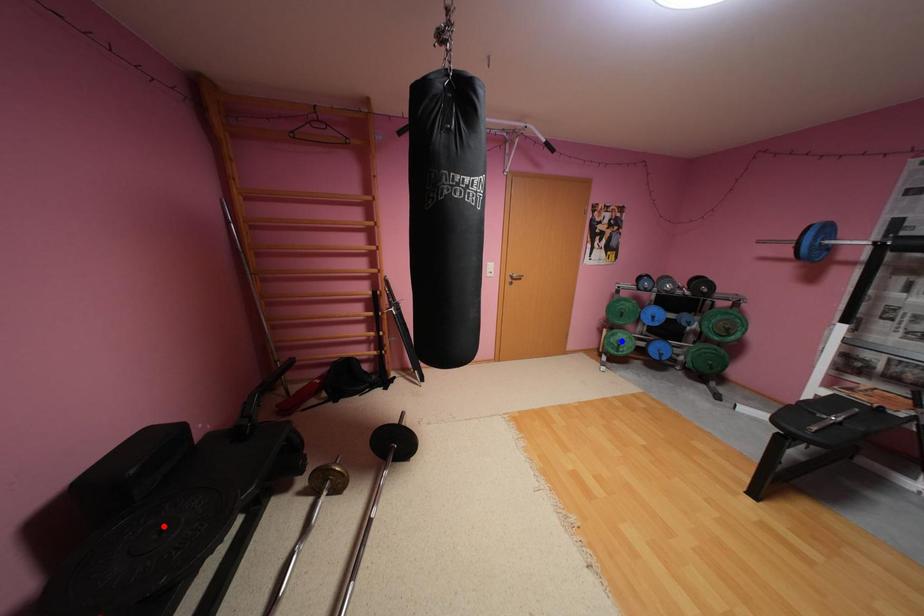
Question: Which of the two points in the image is closer to the camera?

Choices:
 (A) Blue point is closer.
 (B) Red point is closer.

Answer: (B)